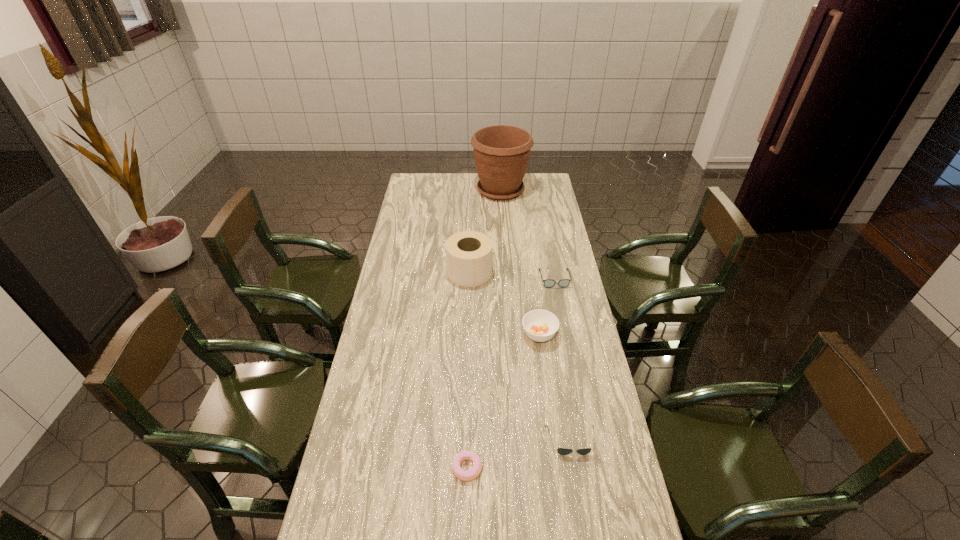
Where is `the tallest object`? Image resolution: width=960 pixels, height=540 pixels. the tallest object is located at coordinates (501, 153).

Where is `the farthest object`? The width and height of the screenshot is (960, 540). the farthest object is located at coordinates (x=501, y=153).

I want to click on toilet tissue, so click(x=469, y=254).

Find the location of `the third nearest object`. the third nearest object is located at coordinates (539, 325).

This screenshot has width=960, height=540. I want to click on the fourth shortest object, so click(x=539, y=325).

Where is `spectacles`? The image size is (960, 540). spectacles is located at coordinates (548, 283).

Find the location of `sunglasses`. sunglasses is located at coordinates (562, 451).

Identify the location of doughnut. Image resolution: width=960 pixels, height=540 pixels. (472, 474).

Where is `vacant region located 0.320m on the front of the farthest object`? This screenshot has width=960, height=540. vacant region located 0.320m on the front of the farthest object is located at coordinates (504, 243).

The image size is (960, 540). Find the location of `vacant space located 0.360m on the front of the toilet tissue`. vacant space located 0.360m on the front of the toilet tissue is located at coordinates [x=468, y=356].